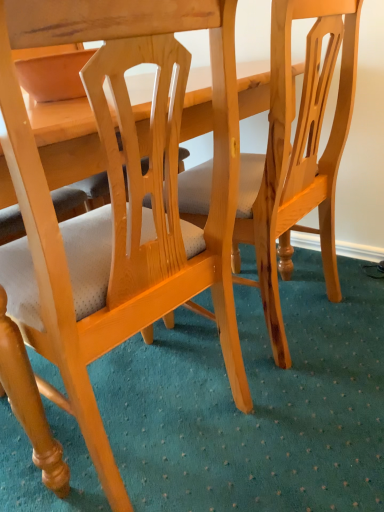
Question: From the image's perspective, does light brown wood chair at center, which ranks as the 2th chair in right-to-left order, appear lower than light brown wood chair at center, which is counted as the second chair, starting from the left?

Choices:
 (A) no
 (B) yes

Answer: (B)

Question: From a real-world perspective, is light brown wood chair at center, which is counted as the 1th chair, starting from the left, under light brown wood chair at center, which ranks as the 1th chair in right-to-left order?

Choices:
 (A) yes
 (B) no

Answer: (B)

Question: Can you confirm if light brown wood chair at center, which is counted as the 1th chair, starting from the left, is taller than light brown wood chair at center, which is counted as the second chair, starting from the left?

Choices:
 (A) no
 (B) yes

Answer: (B)

Question: Can we say light brown wood chair at center, which is counted as the 1th chair, starting from the left, lies outside light brown wood chair at center, which ranks as the 1th chair in right-to-left order?

Choices:
 (A) no
 (B) yes

Answer: (B)

Question: Considering the relative sizes of light brown wood chair at center, which ranks as the 2th chair in right-to-left order, and light brown wood chair at center, which is counted as the second chair, starting from the left, in the image provided, is light brown wood chair at center, which ranks as the 2th chair in right-to-left order, smaller than light brown wood chair at center, which is counted as the second chair, starting from the left,?

Choices:
 (A) no
 (B) yes

Answer: (A)

Question: Is there a large distance between light brown wood chair at center, which ranks as the 2th chair in right-to-left order, and light brown wood chair at center, which ranks as the 1th chair in right-to-left order?

Choices:
 (A) no
 (B) yes

Answer: (A)

Question: Is light brown wood chair at center, which is counted as the 1th chair, starting from the left, completely or partially inside light brown wood chair at center, which is counted as the second chair, starting from the left?

Choices:
 (A) no
 (B) yes

Answer: (A)

Question: Is light brown wood chair at center, which ranks as the 1th chair in right-to-left order, positioned with its back to light brown wood chair at center, which ranks as the 2th chair in right-to-left order?

Choices:
 (A) yes
 (B) no

Answer: (B)

Question: Is light brown wood chair at center, which is counted as the second chair, starting from the left, taller than light brown wood chair at center, which is counted as the 1th chair, starting from the left?

Choices:
 (A) no
 (B) yes

Answer: (A)

Question: Is light brown wood chair at center, which is counted as the second chair, starting from the left, shorter than light brown wood chair at center, which ranks as the 2th chair in right-to-left order?

Choices:
 (A) no
 (B) yes

Answer: (B)

Question: Can you confirm if light brown wood chair at center, which is counted as the second chair, starting from the left, is wider than light brown wood chair at center, which is counted as the 1th chair, starting from the left?

Choices:
 (A) yes
 (B) no

Answer: (B)

Question: Considering the relative positions of light brown wood chair at center, which is counted as the second chair, starting from the left, and light brown wood chair at center, which ranks as the 2th chair in right-to-left order, in the image provided, is light brown wood chair at center, which is counted as the second chair, starting from the left, to the left of light brown wood chair at center, which ranks as the 2th chair in right-to-left order, from the viewer's perspective?

Choices:
 (A) yes
 (B) no

Answer: (B)

Question: Is point (259, 203) closer or farther from the camera than point (172, 108)?

Choices:
 (A) closer
 (B) farther

Answer: (B)